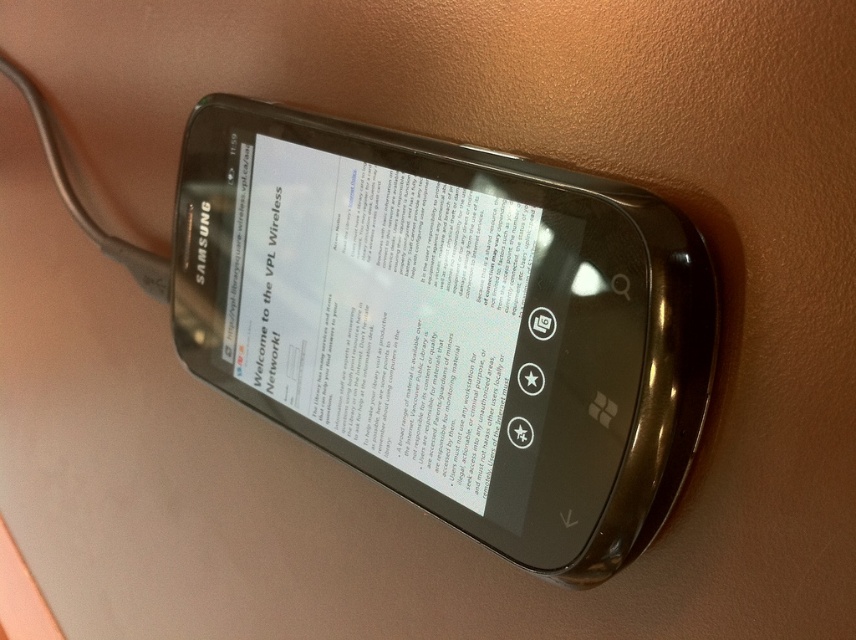
Is metallic glossy smartphone at center positioned in front of white glossy paper at center?

Yes, metallic glossy smartphone at center is closer to the viewer.

Does metallic glossy smartphone at center have a lesser height compared to white glossy paper at center?

No.

Which is in front, point (314, 412) or point (352, 204)?

Point (352, 204) is more forward.

At what (x,y) coordinates should I click in order to perform the action: click on metallic glossy smartphone at center. Please return your answer as a coordinate pair (x, y). Image resolution: width=856 pixels, height=640 pixels. Looking at the image, I should click on (449, 323).